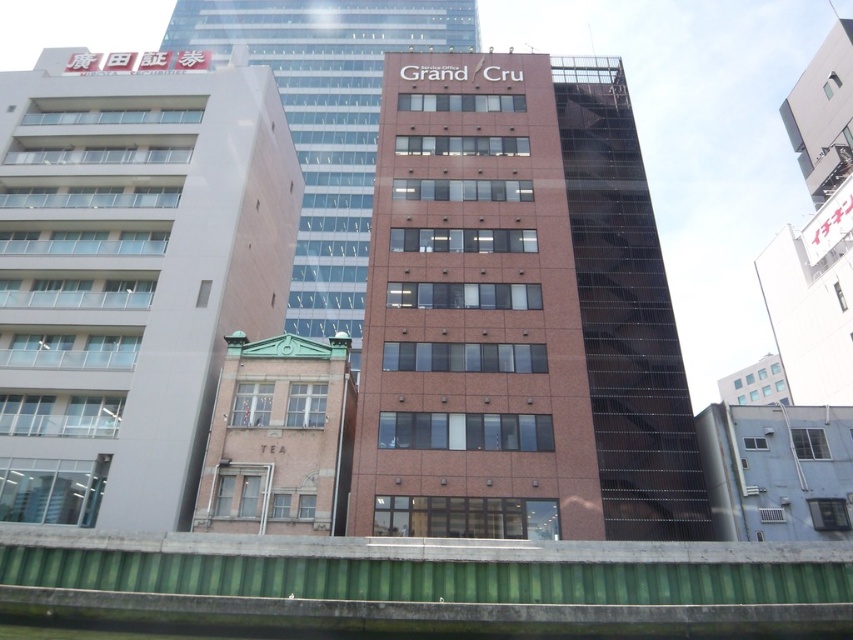
Does brick building at center have a larger size compared to brown brick building at lower left?

Yes.

Is brick building at center above brown brick building at lower left?

Indeed, brick building at center is positioned over brown brick building at lower left.

Which is in front, point (283, 77) or point (244, 396)?

Point (244, 396) is in front.

Where is `brick building at center`? brick building at center is located at coordinates (328, 116).

Find the location of a particular element. This screenshot has height=640, width=853. green concrete wall at lower center is located at coordinates (428, 582).

Between point (86, 577) and point (764, 534), which one is positioned behind?

Point (764, 534)

Image resolution: width=853 pixels, height=640 pixels. Identify the location of green concrete wall at lower center. (428, 582).

Between brown brick building at center and green concrete wall at lower center, which one is positioned higher?

brown brick building at center is higher up.

Is point (383, 122) less distant than point (782, 563)?

No, (383, 122) is further to viewer.

The height and width of the screenshot is (640, 853). In order to click on brown brick building at center in this screenshot , I will do `click(518, 310)`.

Find the location of a particular element. brown brick building at center is located at coordinates (518, 310).